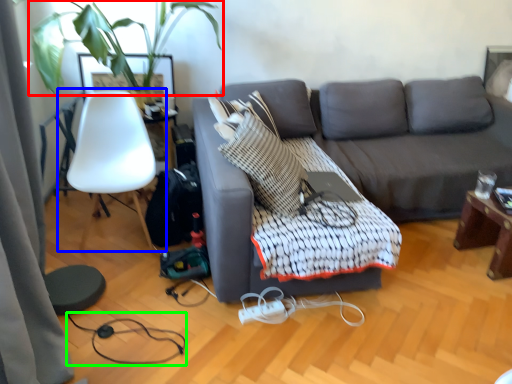
Question: Which object is the closest to the plant (highlighted by a red box)? Choose among these: chair (highlighted by a blue box) or cable (highlighted by a green box).

Choices:
 (A) chair
 (B) cable

Answer: (A)